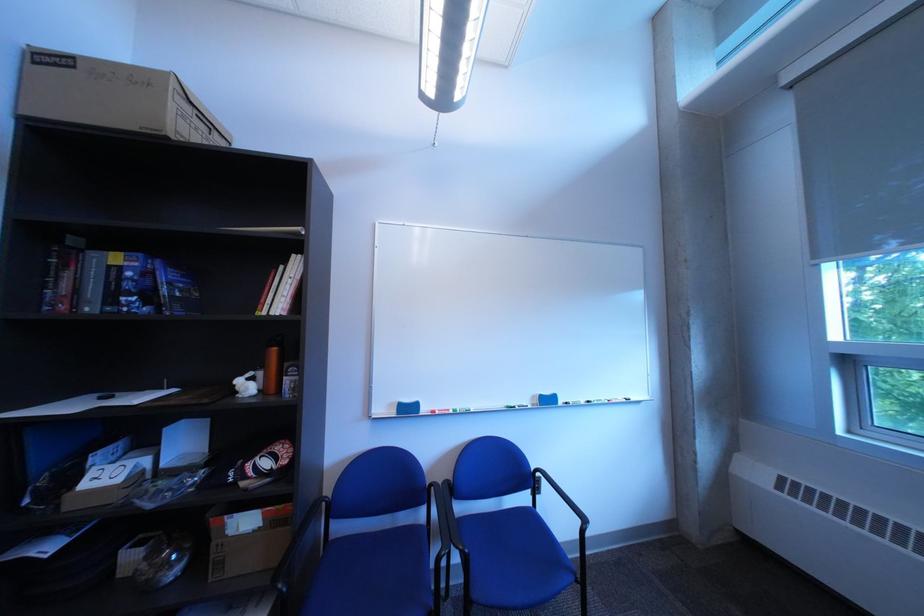
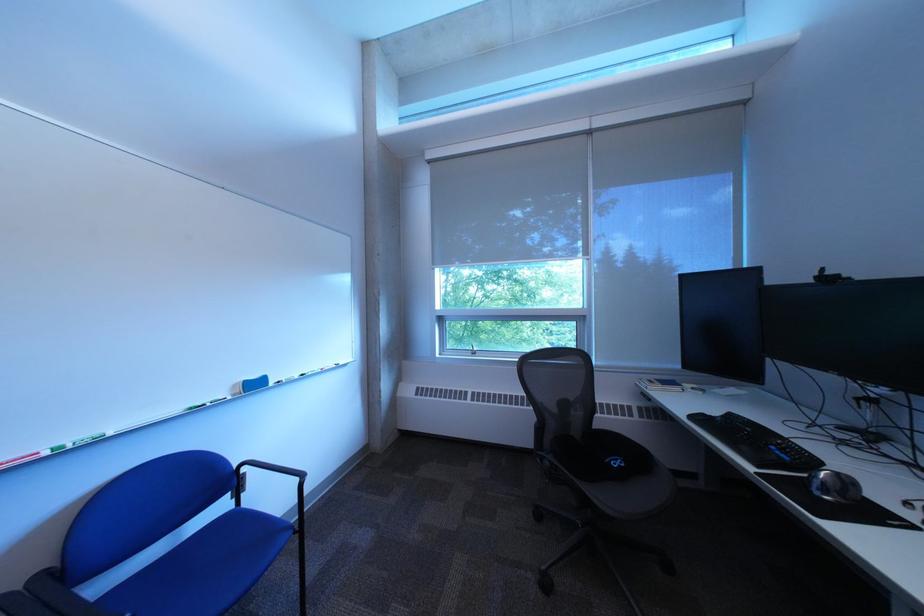
Question: Based on the continuous images, in which direction is the camera rotating? Reply with the corresponding letter.

Choices:
 (A) Left
 (B) Right
 (C) Up
 (D) Down

Answer: (B)